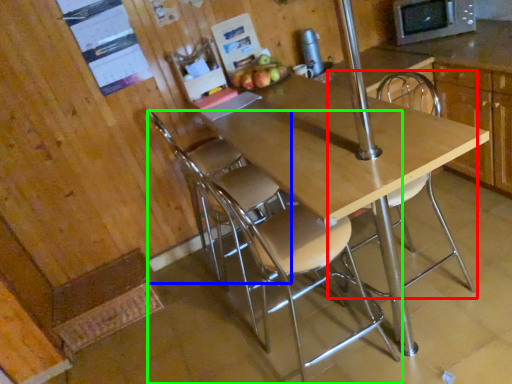
Question: Estimate the real-world distances between objects in this image. Which object is farther from chair (highlighted by a red box), chair (highlighted by a blue box) or chair (highlighted by a green box)?

Choices:
 (A) chair
 (B) chair

Answer: (A)